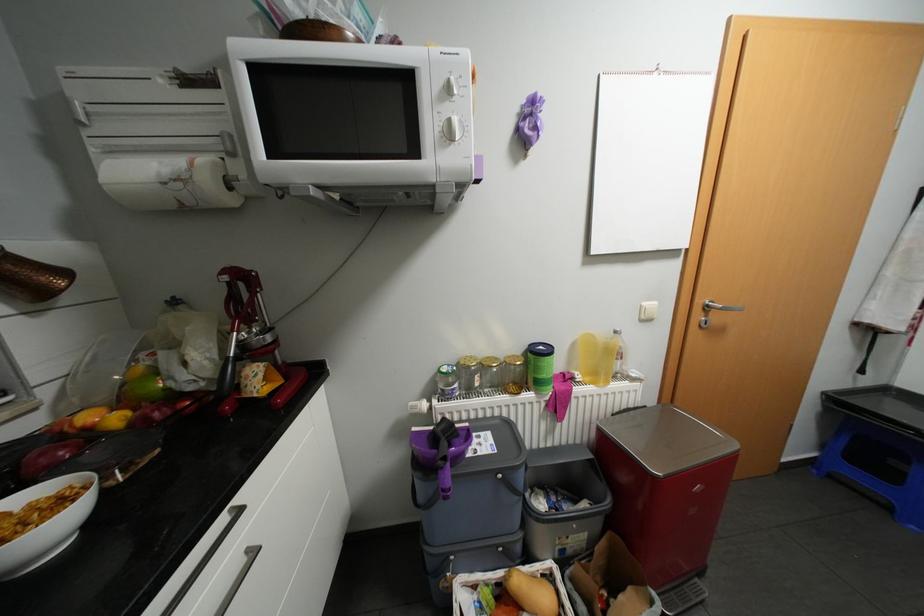
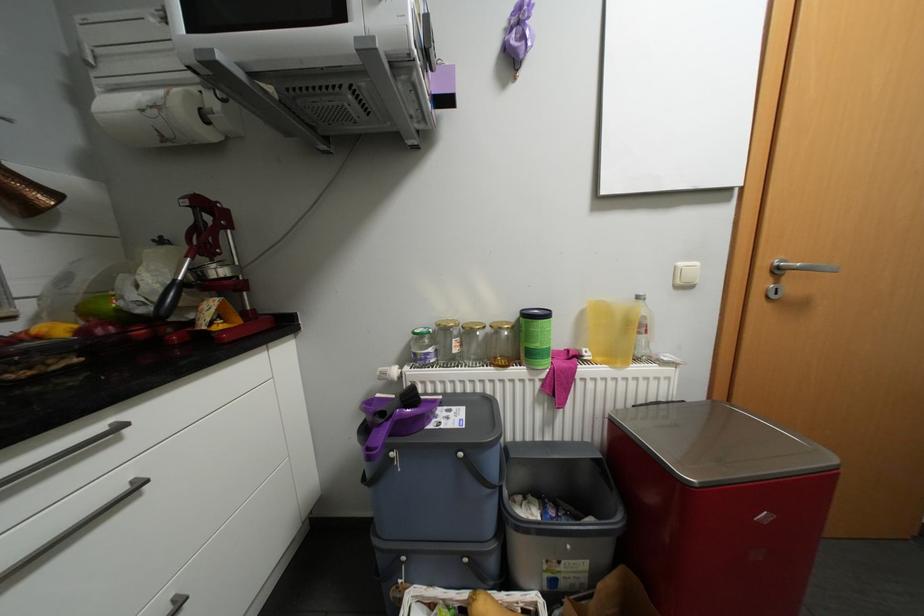
The images are taken continuously from a first-person perspective. In which direction are you moving?

The movement direction of the cameraman is right, forward.